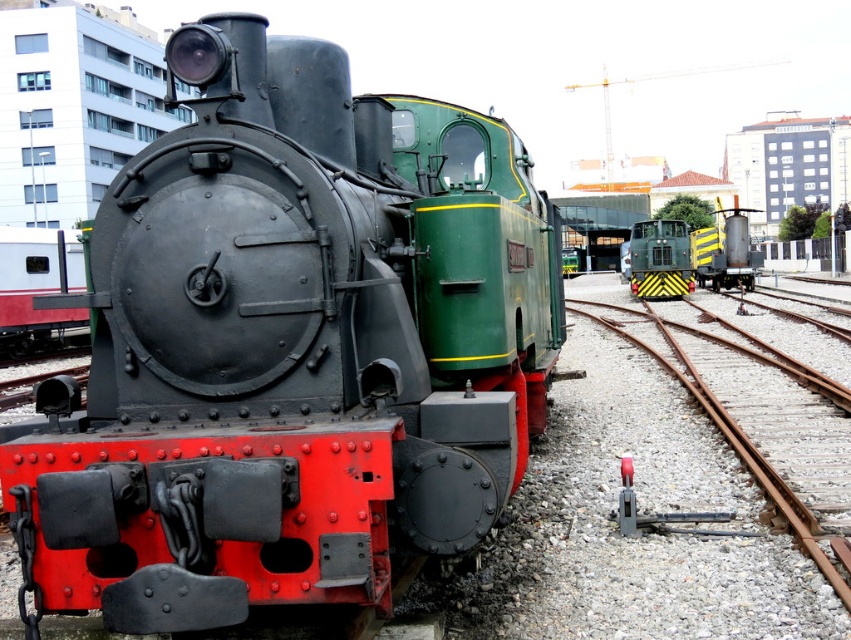
Who is taller, matte black locomotive at center or rusty metal train track at center?

rusty metal train track at center is taller.

Does matte black locomotive at center have a lesser width compared to rusty metal train track at center?

Correct, matte black locomotive at center's width is less than rusty metal train track at center's.

Where is `matte black locomotive at center`? matte black locomotive at center is located at coordinates (287, 348).

Image resolution: width=851 pixels, height=640 pixels. I want to click on matte black locomotive at center, so click(287, 348).

Who is positioned more to the left, rusty metal train track at center or green/yellow striped train at center?

Positioned to the left is rusty metal train track at center.

At what (x,y) coordinates should I click in order to perform the action: click on rusty metal train track at center. Please return your answer as a coordinate pair (x, y). The width and height of the screenshot is (851, 640). Looking at the image, I should click on (760, 426).

Does point (712, 358) come closer to viewer compared to point (654, 236)?

That is True.

This screenshot has height=640, width=851. What are the coordinates of `rusty metal train track at center` in the screenshot? It's located at (760, 426).

Is point (324, 449) more distant than point (629, 282)?

No, it is in front of (629, 282).

Which is behind, point (517, 324) or point (637, 266)?

Positioned behind is point (637, 266).

Which is in front, point (121, 474) or point (652, 221)?

Point (121, 474) is more forward.

Find the location of `matte black locomotive at center`. matte black locomotive at center is located at coordinates (287, 348).